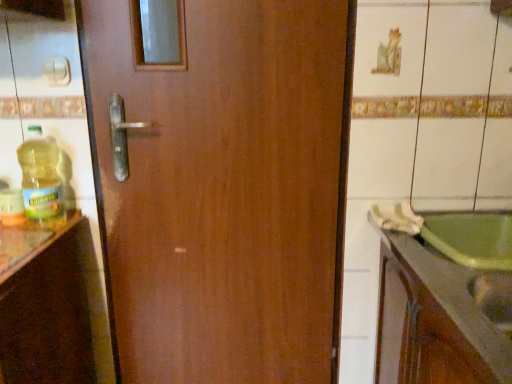
Question: Is green glossy sink at lower right situated inside translucent plastic bottle at left or outside?

Choices:
 (A) inside
 (B) outside

Answer: (B)

Question: From the image's perspective, is green glossy sink at lower right positioned above or below translucent plastic bottle at left?

Choices:
 (A) above
 (B) below

Answer: (B)

Question: Based on their sizes in the image, would you say green glossy sink at lower right is bigger or smaller than translucent plastic bottle at left?

Choices:
 (A) big
 (B) small

Answer: (A)

Question: From a real-world perspective, is translucent plastic bottle at left physically located above or below green glossy sink at lower right?

Choices:
 (A) above
 (B) below

Answer: (A)

Question: Is translucent plastic bottle at left situated inside green glossy sink at lower right or outside?

Choices:
 (A) outside
 (B) inside

Answer: (A)

Question: Considering the positions of point (55, 173) and point (406, 301), is point (55, 173) closer or farther from the camera than point (406, 301)?

Choices:
 (A) closer
 (B) farther

Answer: (B)

Question: Considering their positions, is translucent plastic bottle at left located in front of or behind green glossy sink at lower right?

Choices:
 (A) behind
 (B) front

Answer: (A)